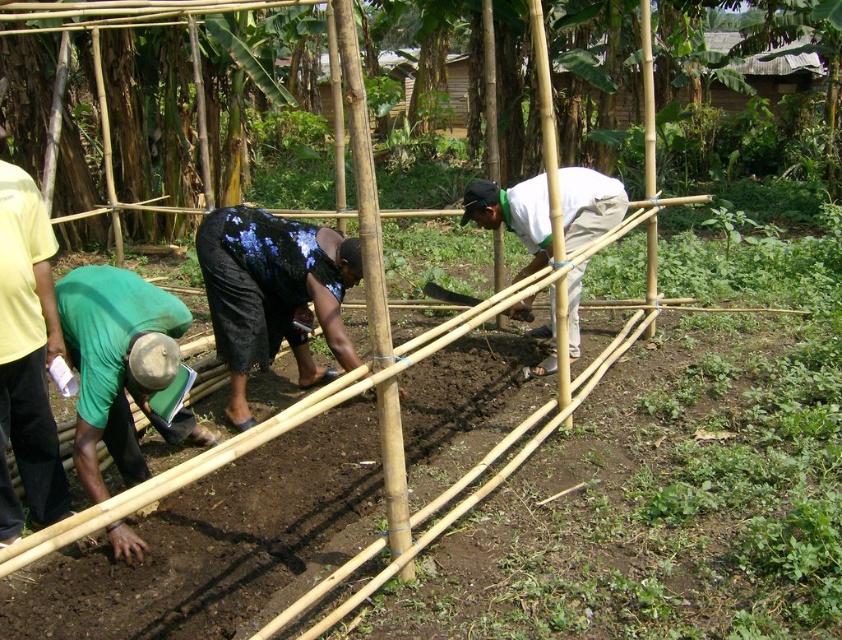
The height and width of the screenshot is (640, 842). Identify the location of white cotton shirt at center. (513, 216).

Which is more to the left, white cotton shirt at center or smooth wooden shovel at center?

From the viewer's perspective, smooth wooden shovel at center appears more on the left side.

Identify the location of white cotton shirt at center. The width and height of the screenshot is (842, 640). (513, 216).

Who is positioned more to the right, green fabric shirt at lower left or smooth wooden shovel at center?

From the viewer's perspective, smooth wooden shovel at center appears more on the right side.

Is point (125, 326) less distant than point (525, 308)?

Yes, it is.

This screenshot has height=640, width=842. I want to click on green fabric shirt at lower left, so click(x=120, y=365).

Between black sequined dress at center and green fabric shirt at left, which one is positioned higher?

black sequined dress at center is higher up.

Does point (328, 234) come in front of point (13, 216)?

No, it is behind (13, 216).

Measure the distance between point (244, 372) and camera.

Point (244, 372) and camera are 4.45 meters apart from each other.

Where is `black sequined dress at center`? This screenshot has height=640, width=842. black sequined dress at center is located at coordinates (273, 292).